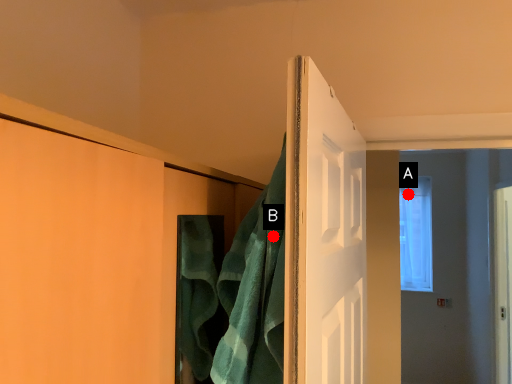
Question: Two points are circled on the image, labeled by A and B beside each circle. Which of the following is the closest to the observer?

Choices:
 (A) A is closer
 (B) B is closer

Answer: (B)